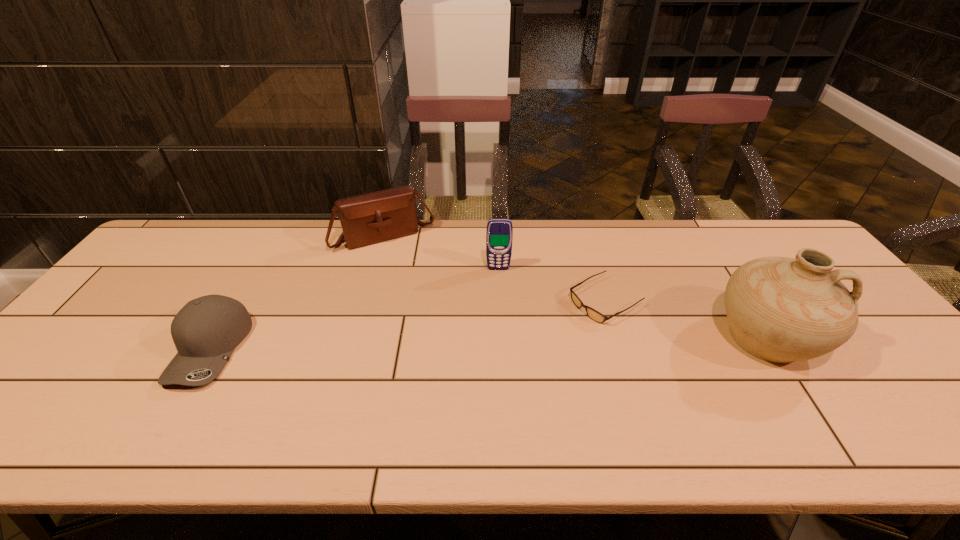
Locate an element on the screen. free space that is in between the second object from right to left and the rightmost object is located at coordinates (686, 319).

Image resolution: width=960 pixels, height=540 pixels. What are the coordinates of `unoccupied position between the fourth tallest object and the second farthest object` in the screenshot? It's located at (354, 309).

Locate an element on the screen. This screenshot has height=540, width=960. vacant area that lies between the baseball cap and the farthest object is located at coordinates (298, 293).

Find the location of a particular element. The height and width of the screenshot is (540, 960). object identified as the closest to the leftmost object is located at coordinates (370, 218).

Image resolution: width=960 pixels, height=540 pixels. I want to click on the closest object relative to the shortest object, so click(779, 309).

Locate an element on the screen. This screenshot has width=960, height=540. blank area in the image that satisfies the following two spatial constraints: 1. on the front side of the cellular telephone; 2. on the left side of the second object from right to left is located at coordinates [x=500, y=301].

Image resolution: width=960 pixels, height=540 pixels. What are the coordinates of `vacant region that satisfies the following two spatial constraints: 1. on the front side of the second object from left to right; 2. on the right side of the cellular telephone` in the screenshot? It's located at (375, 269).

Where is `vacant space that satisfies the following two spatial constraints: 1. on the front side of the pottery; 2. on the right side of the second object from right to left`? This screenshot has width=960, height=540. vacant space that satisfies the following two spatial constraints: 1. on the front side of the pottery; 2. on the right side of the second object from right to left is located at coordinates (616, 338).